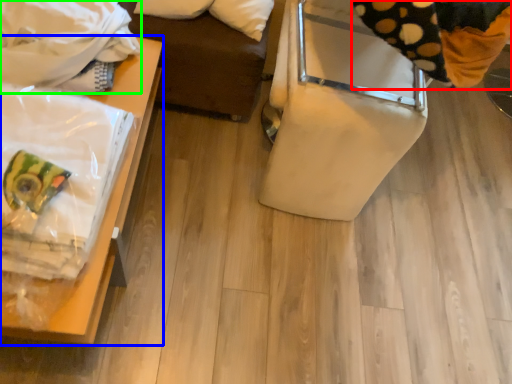
Question: Based on their relative distances, which object is farther from material (highlighted by a red box)? Choose from furniture (highlighted by a blue box) and blanket (highlighted by a green box).

Choices:
 (A) furniture
 (B) blanket

Answer: (B)